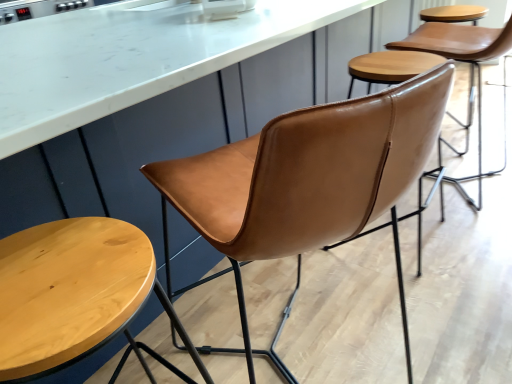
Question: Should I look upward or downward to see wooden stool at lower left?

Choices:
 (A) up
 (B) down

Answer: (B)

Question: From the image's perspective, is cognac leather chair at center, which is counted as the second chair, starting from the right, below cognac leather chair at center, acting as the 2th chair starting from the left?

Choices:
 (A) yes
 (B) no

Answer: (A)

Question: Is cognac leather chair at center, acting as the 1th chair starting from the front, to the left of cognac leather chair at center, the 2th chair positioned from the front, from the viewer's perspective?

Choices:
 (A) no
 (B) yes

Answer: (B)

Question: Is cognac leather chair at center, which is counted as the second chair, starting from the right, oriented towards cognac leather chair at center, the 2th chair positioned from the front?

Choices:
 (A) yes
 (B) no

Answer: (B)

Question: Does cognac leather chair at center, which is the second chair in back-to-front order, touch cognac leather chair at center, acting as the 1th chair starting from the right?

Choices:
 (A) no
 (B) yes

Answer: (A)

Question: Is cognac leather chair at center, which is counted as the second chair, starting from the right, to the right of cognac leather chair at center, acting as the 2th chair starting from the left, from the viewer's perspective?

Choices:
 (A) no
 (B) yes

Answer: (A)

Question: From the image's perspective, would you say cognac leather chair at center, which is counted as the second chair, starting from the right, is positioned over cognac leather chair at center, which appears as the first chair when viewed from the back?

Choices:
 (A) no
 (B) yes

Answer: (A)

Question: Considering the relative positions of cognac leather chair at center, acting as the 1th chair starting from the right, and cognac leather chair at center, acting as the 1th chair starting from the front, in the image provided, is cognac leather chair at center, acting as the 1th chair starting from the right, to the left of cognac leather chair at center, acting as the 1th chair starting from the front, from the viewer's perspective?

Choices:
 (A) no
 (B) yes

Answer: (A)

Question: Considering the relative sizes of cognac leather chair at center, acting as the 2th chair starting from the left, and cognac leather chair at center, arranged as the first chair when viewed from the left, in the image provided, is cognac leather chair at center, acting as the 2th chair starting from the left, bigger than cognac leather chair at center, arranged as the first chair when viewed from the left,?

Choices:
 (A) yes
 (B) no

Answer: (B)

Question: From the image's perspective, does cognac leather chair at center, which appears as the first chair when viewed from the back, appear higher than cognac leather chair at center, acting as the 1th chair starting from the front?

Choices:
 (A) no
 (B) yes

Answer: (B)

Question: Considering the relative sizes of cognac leather chair at center, acting as the 2th chair starting from the left, and cognac leather chair at center, which is counted as the second chair, starting from the right, in the image provided, is cognac leather chair at center, acting as the 2th chair starting from the left, wider than cognac leather chair at center, which is counted as the second chair, starting from the right,?

Choices:
 (A) no
 (B) yes

Answer: (B)

Question: Does cognac leather chair at center, the 2th chair positioned from the front, appear on the right side of cognac leather chair at center, acting as the 1th chair starting from the front?

Choices:
 (A) no
 (B) yes

Answer: (B)

Question: Is cognac leather chair at center, acting as the 1th chair starting from the front, completely or partially inside cognac leather chair at center, acting as the 2th chair starting from the left?

Choices:
 (A) no
 (B) yes

Answer: (A)

Question: Can you confirm if cognac leather chair at center, which is counted as the second chair, starting from the right, is smaller than wooden stool at lower left?

Choices:
 (A) no
 (B) yes

Answer: (A)